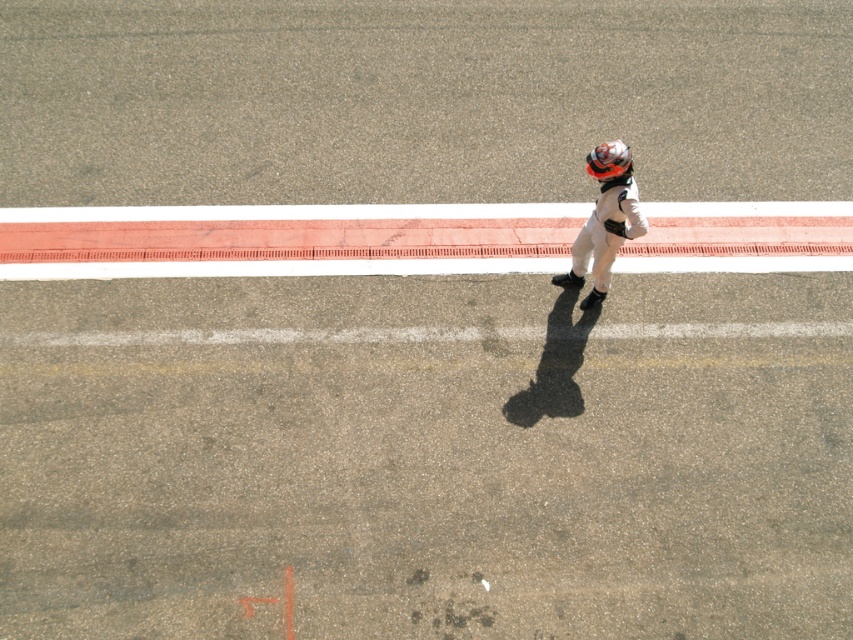
Does point (260, 259) lie in front of point (596, 160)?

No.

Which of these two, white smooth line at center or shiny orange helmet at upper right, stands taller?

Standing taller between the two is white smooth line at center.

Find the location of `white smooth line at center`. white smooth line at center is located at coordinates (285, 240).